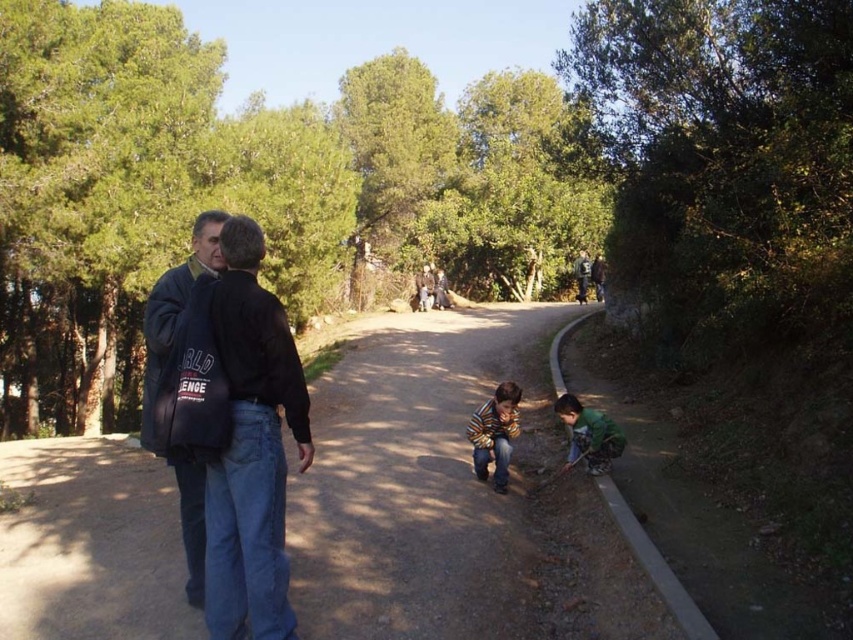
Question: Which point is farther from the camera taking this photo?

Choices:
 (A) pos(581,275)
 (B) pos(614,442)
 (C) pos(508,474)
 (D) pos(213,220)

Answer: (A)

Question: Can you confirm if striped cotton shirt at center is thinner than dark blue jacket at center?

Choices:
 (A) yes
 (B) no

Answer: (A)

Question: Which point is farther to the camera?

Choices:
 (A) (224, 230)
 (B) (506, 440)
 (C) (585, 260)

Answer: (C)

Question: Can you confirm if green matte jacket at lower right is positioned below dark blue jacket at center?

Choices:
 (A) no
 (B) yes

Answer: (B)

Question: Which object appears closest to the camera in this image?

Choices:
 (A) dark blue jacket at center
 (B) black cotton jacket at left
 (C) striped cotton shirt at center

Answer: (B)

Question: Does black cotton jacket at left appear under green matte jacket at lower right?

Choices:
 (A) yes
 (B) no

Answer: (B)